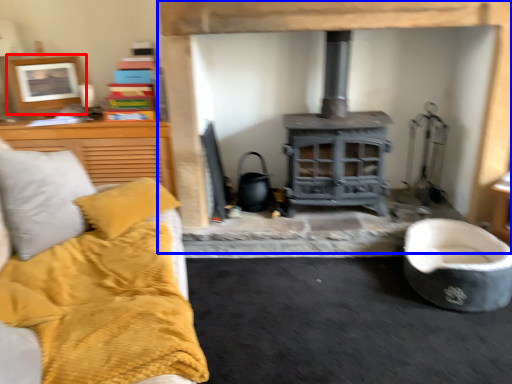
Question: Among these objects, which one is nearest to the camera, picture frame (highlighted by a red box) or fireplace (highlighted by a blue box)?

Choices:
 (A) picture frame
 (B) fireplace

Answer: (B)